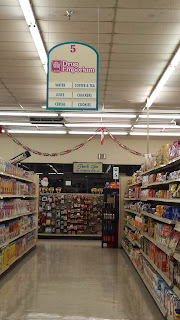
Where is `floor`? floor is located at coordinates (66, 262).